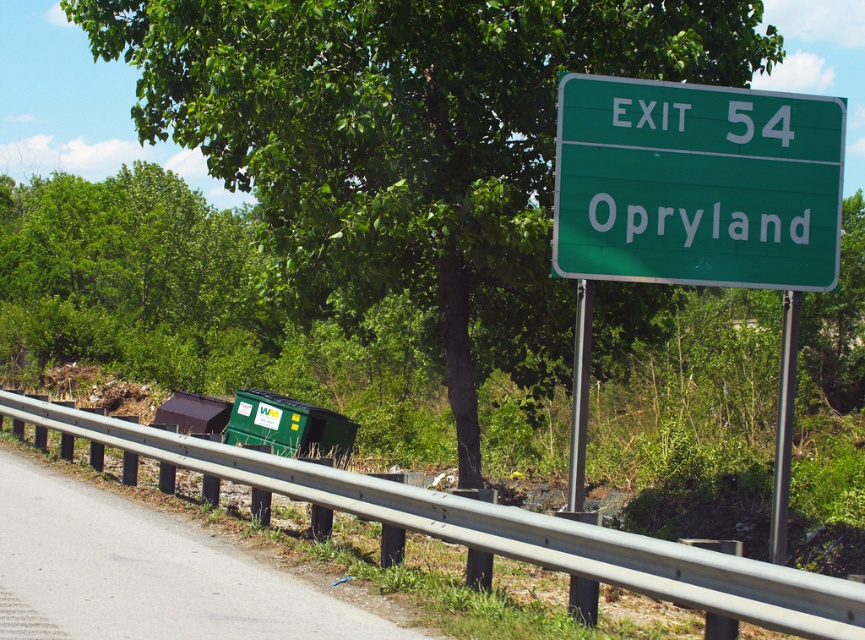
Question: Which point is closer to the camera taking this photo?

Choices:
 (A) (191, 42)
 (B) (78, 588)

Answer: (B)

Question: Does green leafy tree at upper center have a smaller size compared to green plastic trash can at lower center?

Choices:
 (A) yes
 (B) no

Answer: (B)

Question: Which object is positioned closest to the green matte sign at upper center?

Choices:
 (A) green leafy tree at upper center
 (B) green plastic trash can at lower center

Answer: (A)

Question: Is green matte sign at upper center to the right of green plastic trash can at lower center from the viewer's perspective?

Choices:
 (A) no
 (B) yes

Answer: (B)

Question: Which object is farther from the camera taking this photo?

Choices:
 (A) green plastic trash can at lower center
 (B) green leafy tree at upper center

Answer: (B)

Question: Can you confirm if green leafy tree at upper center is thinner than green matte sign at upper center?

Choices:
 (A) no
 (B) yes

Answer: (A)